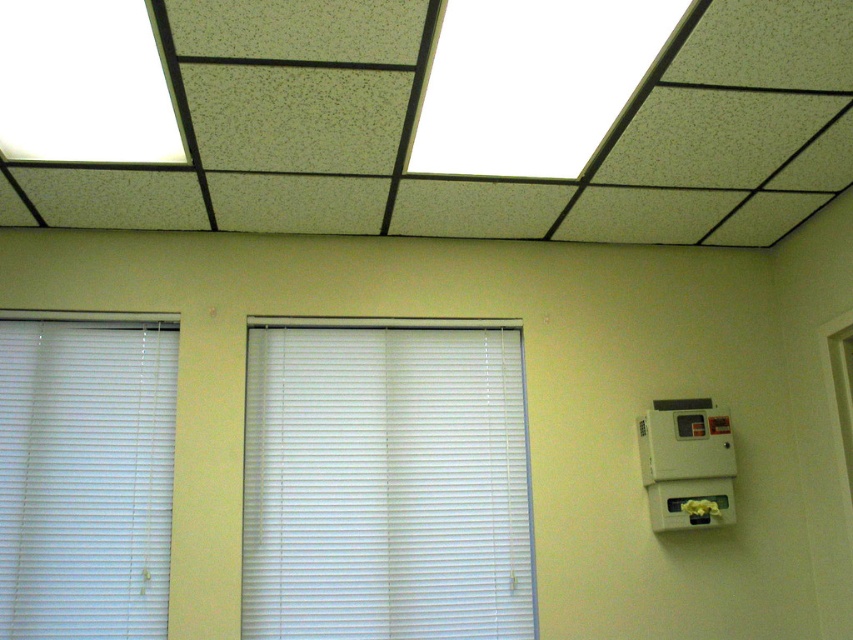
Question: Is white plastic blinds at center below white plastic blinds at left?

Choices:
 (A) no
 (B) yes

Answer: (B)

Question: Can you confirm if white plastic blinds at center is thinner than white plastic blinds at left?

Choices:
 (A) yes
 (B) no

Answer: (B)

Question: Is white plastic blinds at center to the right of white plastic blinds at left from the viewer's perspective?

Choices:
 (A) no
 (B) yes

Answer: (B)

Question: Among these points, which one is nearest to the camera?

Choices:
 (A) tap(109, 508)
 (B) tap(306, 625)

Answer: (B)

Question: Which point is closer to the camera taking this photo?

Choices:
 (A) (138, 344)
 (B) (309, 536)

Answer: (B)